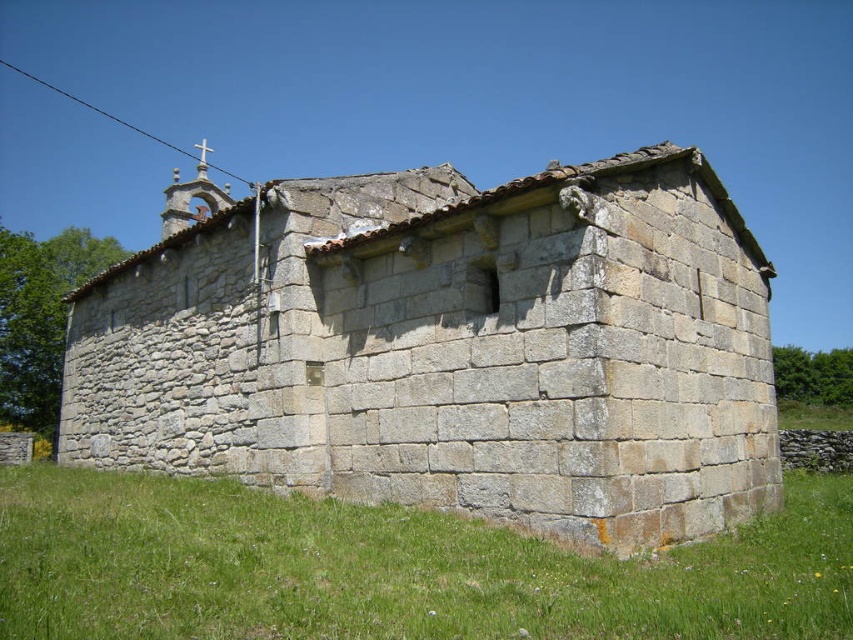
Can you confirm if gray stone church at center is shorter than green grass at lower right?

No.

What do you see at coordinates (450, 348) in the screenshot? The width and height of the screenshot is (853, 640). I see `gray stone church at center` at bounding box center [450, 348].

Describe the element at coordinates (450, 348) in the screenshot. I see `gray stone church at center` at that location.

Image resolution: width=853 pixels, height=640 pixels. I want to click on gray stone church at center, so click(x=450, y=348).